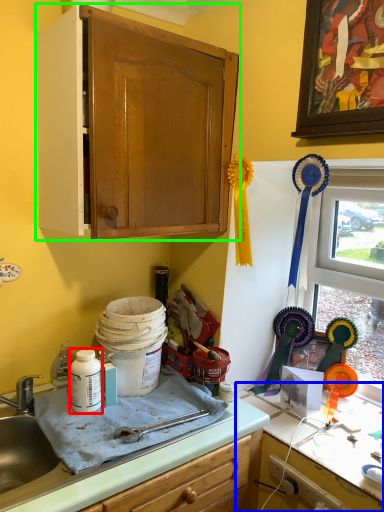
Question: Which object is positioned farthest from bottle (highlighted by a red box)? Select from countertop (highlighted by a blue box) and cabinetry (highlighted by a green box).

Choices:
 (A) countertop
 (B) cabinetry

Answer: (B)